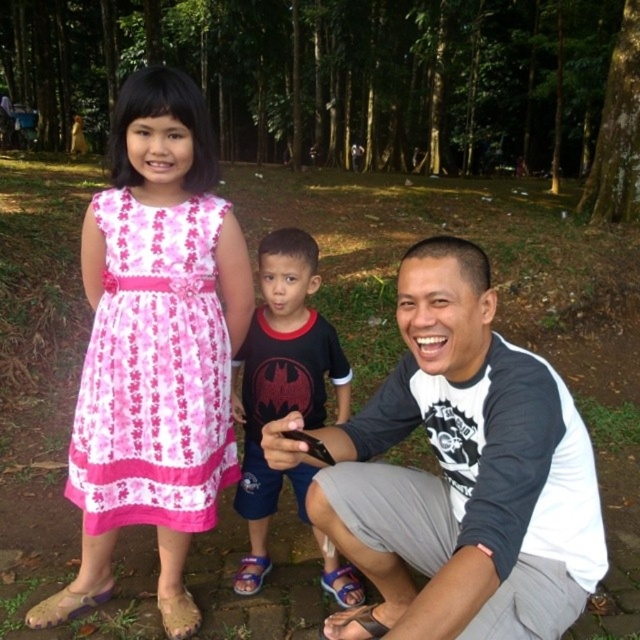
You are standing in the park and see the adult male on the right and the pink fabric dress at left. Which one is closer to you?

The pink fabric dress at left is closer to you since it is 6.51 feet from the viewer, while the adult male on the right is farther away.

You are a photographer trying to capture a group photo of the two children in the scene. You notice both the pink floral dress at left and the pink fabric dress at left. Which child should you position closer to the center to ensure their dress is fully visible in the frame?

The pink floral dress at left is wider than the pink fabric dress at left, so positioning the child wearing the pink floral dress at left closer to the center will ensure their wider dress fits within the frame.